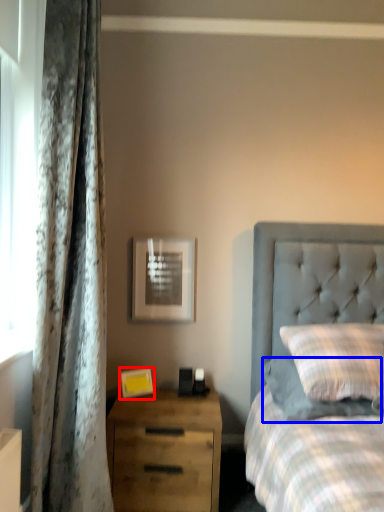
Question: Which point is closer to the camera, picture frame (highlighted by a red box) or pillow (highlighted by a blue box)?

Choices:
 (A) picture frame
 (B) pillow

Answer: (B)